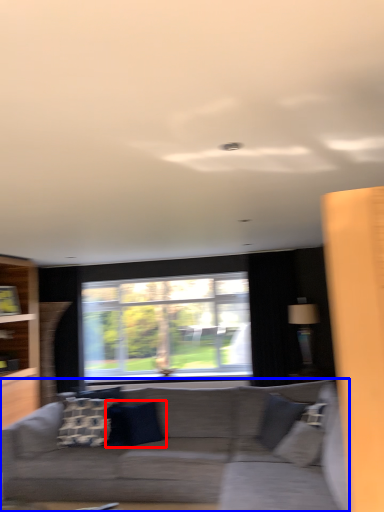
Question: Among these objects, which one is farthest to the camera, pillow (highlighted by a red box) or studio couch (highlighted by a blue box)?

Choices:
 (A) pillow
 (B) studio couch

Answer: (A)